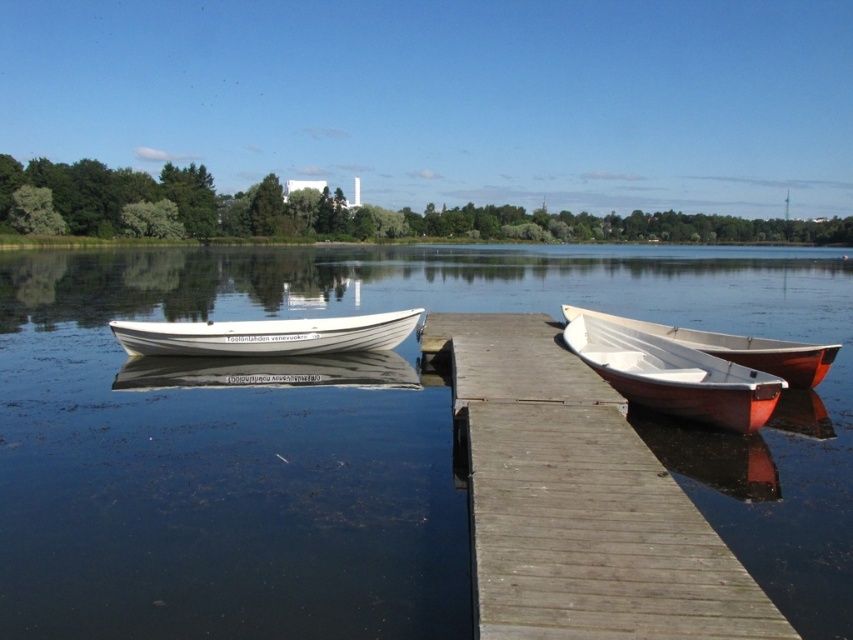
Which is below, white matte canoe at center or white wooden boat at center?

Positioned lower is white matte canoe at center.

Does point (596, 326) lie in front of point (277, 352)?

Yes, it is.

Does point (717, 356) lie in front of point (219, 346)?

Yes, point (717, 356) is in front of point (219, 346).

At what (x,y) coordinates should I click in order to perform the action: click on white matte canoe at center. Please return your answer as a coordinate pair (x, y). This screenshot has width=853, height=640. Looking at the image, I should click on (674, 376).

Is point (260, 538) positioned before point (775, 342)?

Yes, point (260, 538) is in front of point (775, 342).

Who is shorter, clear water at dock center or white matte canoe at right?

With less height is white matte canoe at right.

The image size is (853, 640). Describe the element at coordinates (360, 440) in the screenshot. I see `clear water at dock center` at that location.

Find the location of a particular element. The image size is (853, 640). clear water at dock center is located at coordinates (360, 440).

Does white matte canoe at center have a lesser width compared to white matte canoe at right?

No, white matte canoe at center is not thinner than white matte canoe at right.

Which is in front, point (628, 333) or point (746, 355)?

Point (746, 355)

You are a GUI agent. You are given a task and a screenshot of the screen. Output one action in this format:
    pyautogui.click(x=<x>, y=<y>)
    Task: Click on the white matte canoe at center
    The width and height of the screenshot is (853, 640).
    Given the screenshot: What is the action you would take?
    pyautogui.click(x=674, y=376)